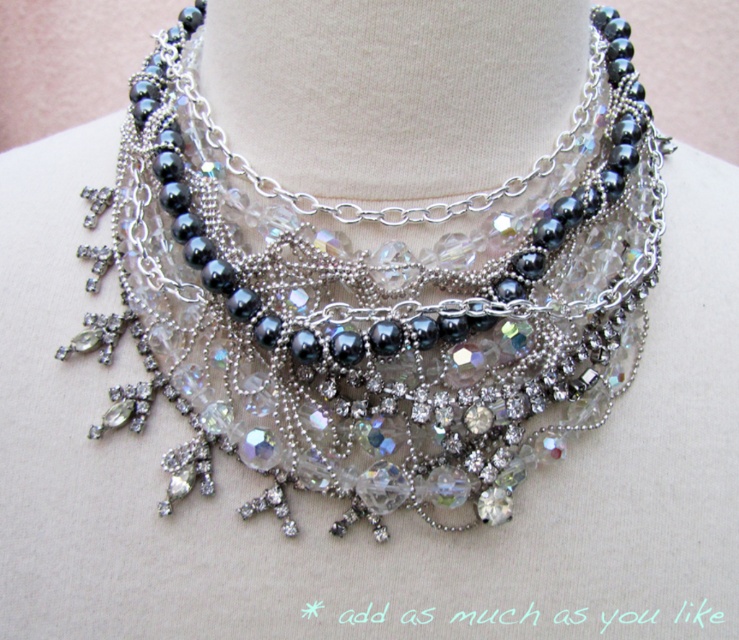
You are a jewelry designer who wants to ensure that the swarovski crystal necklace at center is worn properly. What is the minimum length of the necklace chain required to ensure it fits comfortably around the neck?

The minimum length of the necklace chain required to ensure it fits comfortably around the neck is 31.43 inches.

You are a jewelry designer examining the multi layered necklace. You notice two necklaces at the center of the image, the swarovski crystal necklace at center and the clear crystal necklace at center. Which one has a larger size?

The swarovski crystal necklace at center is bigger than the clear crystal necklace at center according to the description.

You are a jewelry designer who needs to place a new pendant exactly 0.1 units to the right of the swarovski crystal necklace at center. What are the coordinates where you should place the new pendant?

The new pendant should be placed at coordinates approximately (x=378, y=365), since adding 0.1 to the x coordinate of the swarovski crystal necklace at center at (x=378, y=301) would result in (x=378, y=365).